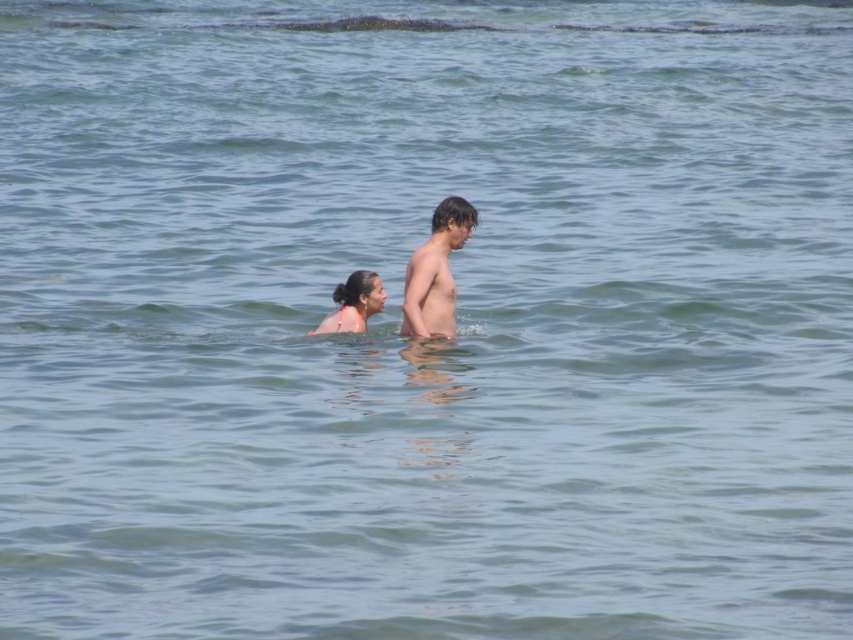
You are a lifeguard on duty at the beach. You notice two people in the water, one at point [448,316] and another at point [445,241]. From your vantage point, which of these two points is further away from you?

Point [448,316] is behind point [445,241], so it is further away from you.

You are a photographer trying to capture a closeup shot of the smooth skin boy at center. Your camera has a focal length of 50mm and you are standing 2 meters away from him. According to the coordinates provided, how far to the left or right should you adjust your camera to center him in your shot?

The smooth skin boy at center is already centered at point coordinates, so no adjustment is needed. The camera should remain at its current position to center him.